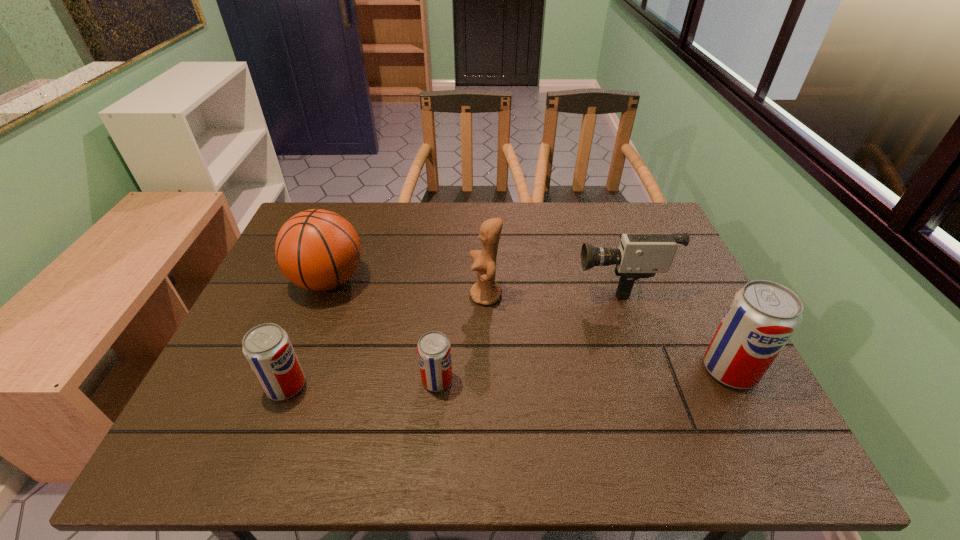
Select which object is the fifth closest to the shortest soda. Please provide its 2D coordinates. Your answer should be formatted as a tuple, i.e. [(x, y)], where the tuple contains the x and y coordinates of a point satisfying the conditions above.

[(763, 315)]

I want to click on soda that stands as the second closest to the fifth tallest object, so click(x=763, y=315).

You are a GUI agent. You are given a task and a screenshot of the screen. Output one action in this format:
    pyautogui.click(x=<x>, y=<y>)
    Task: Click on the soda object that ranks as the closest to the figurine
    This screenshot has height=540, width=960.
    Given the screenshot: What is the action you would take?
    pyautogui.click(x=434, y=351)

Where is `free space that satisfies the following two spatial constraints: 1. on the recording direction of the second object from right to left; 2. on the front side of the basketball`? Image resolution: width=960 pixels, height=540 pixels. free space that satisfies the following two spatial constraints: 1. on the recording direction of the second object from right to left; 2. on the front side of the basketball is located at coordinates (617, 281).

Locate an element on the screen. This screenshot has height=540, width=960. vacant point that satisfies the following two spatial constraints: 1. on the recording direction of the fifth object from left to right; 2. on the front side of the fifth tallest object is located at coordinates (654, 386).

Locate an element on the screen. The image size is (960, 540). free location that satisfies the following two spatial constraints: 1. on the back side of the second shortest soda; 2. on the right side of the shortest object is located at coordinates (288, 380).

Where is `free space that satisfies the following two spatial constraints: 1. on the back side of the rightmost object; 2. on the front-facing side of the third object from right to left`? free space that satisfies the following two spatial constraints: 1. on the back side of the rightmost object; 2. on the front-facing side of the third object from right to left is located at coordinates (692, 295).

Find the location of `vacant area that satisfies the following two spatial constraints: 1. on the recording direction of the camcorder; 2. on the front side of the second shortest object`. vacant area that satisfies the following two spatial constraints: 1. on the recording direction of the camcorder; 2. on the front side of the second shortest object is located at coordinates (654, 386).

You are a GUI agent. You are given a task and a screenshot of the screen. Output one action in this format:
    pyautogui.click(x=<x>, y=<y>)
    Task: Click on the free spot that satisfies the following two spatial constraints: 1. on the recording direction of the fifth object from left to right; 2. on the front side of the fourth object from right to left
    The height and width of the screenshot is (540, 960).
    Given the screenshot: What is the action you would take?
    pyautogui.click(x=652, y=380)

At what (x,y) coordinates should I click in order to perform the action: click on vacant space that satisfies the following two spatial constraints: 1. on the recording direction of the camcorder; 2. on the front side of the second shortest soda. Please return your answer as a coordinate pair (x, y). This screenshot has width=960, height=540. Looking at the image, I should click on (654, 386).